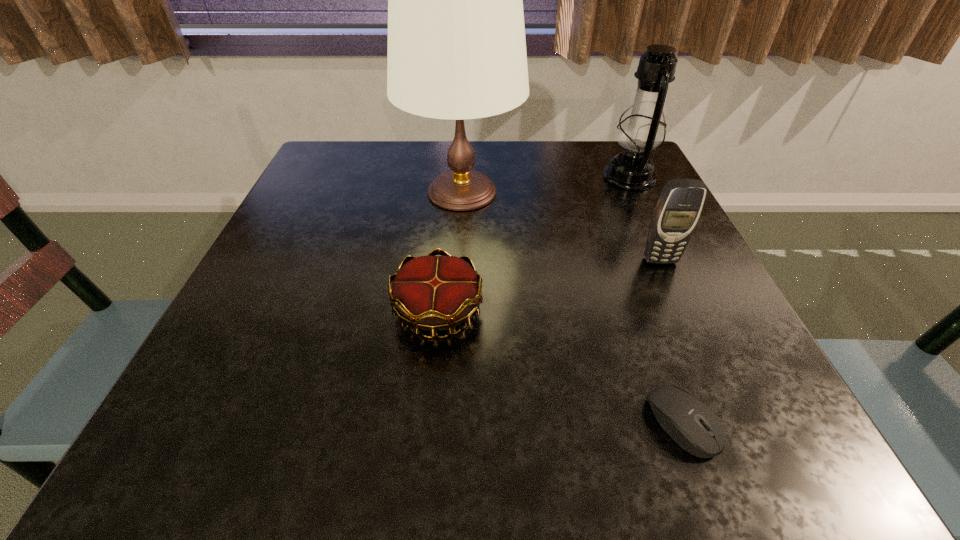
Locate an element on the screen. Image resolution: width=960 pixels, height=540 pixels. object at the near right corner is located at coordinates (688, 421).

The image size is (960, 540). In order to click on blank space at the far edge of the desktop in this screenshot , I will do `click(443, 164)`.

At what (x,y) coordinates should I click in order to perform the action: click on vacant region at the near edge of the desktop. Please return your answer as a coordinate pair (x, y). Image resolution: width=960 pixels, height=540 pixels. Looking at the image, I should click on (604, 406).

Where is `blank space at the left edge of the desktop`? The width and height of the screenshot is (960, 540). blank space at the left edge of the desktop is located at coordinates (219, 370).

At what (x,y) coordinates should I click in order to perform the action: click on vacant space at the right edge of the desktop. Please return your answer as a coordinate pair (x, y). Looking at the image, I should click on (642, 259).

You are a GUI agent. You are given a task and a screenshot of the screen. Output one action in this format:
    pyautogui.click(x=<x>, y=<y>)
    Task: Click on the free location at the far left corner
    The height and width of the screenshot is (540, 960).
    Given the screenshot: What is the action you would take?
    pyautogui.click(x=323, y=153)

In order to click on free space at the near left corner of the desktop in this screenshot , I will do `click(191, 460)`.

This screenshot has height=540, width=960. Find the location of `vacant space at the far right corner of the desktop`. vacant space at the far right corner of the desktop is located at coordinates (602, 144).

Where is `empty space between the oil lamp and the third nearest object`? The width and height of the screenshot is (960, 540). empty space between the oil lamp and the third nearest object is located at coordinates (644, 219).

Locate an element on the screen. The height and width of the screenshot is (540, 960). free space between the crown and the tallest object is located at coordinates (450, 252).